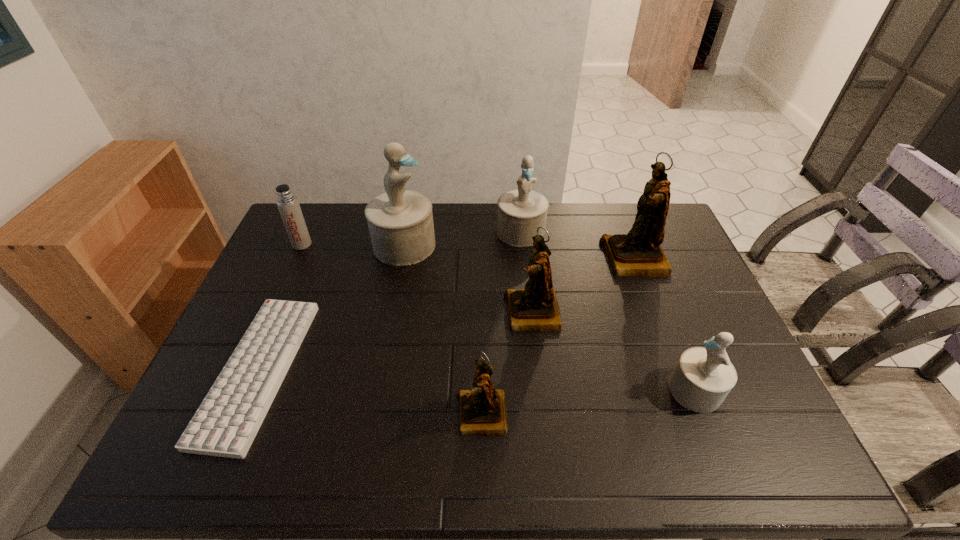
Where is `figurine that is at the near edge`? The image size is (960, 540). figurine that is at the near edge is located at coordinates (483, 412).

This screenshot has height=540, width=960. In order to click on computer keyboard that is at the near edge in this screenshot , I will do `click(225, 424)`.

Identify the location of thermos bottle present at the left edge. This screenshot has height=540, width=960. (287, 203).

Locate an element on the screen. computer keyboard that is at the left edge is located at coordinates (225, 424).

Locate an element on the screen. This screenshot has width=960, height=540. object that is at the far left corner is located at coordinates (287, 203).

You are a GUI agent. You are given a task and a screenshot of the screen. Output one action in this format:
    pyautogui.click(x=<x>, y=<y>)
    Task: Click on the object located at the near left corner
    
    Given the screenshot: What is the action you would take?
    [225, 424]

What are the coordinates of `object located at the far right corner` in the screenshot? It's located at (638, 253).

You are a GUI agent. You are given a task and a screenshot of the screen. Output one action in this format:
    pyautogui.click(x=<x>, y=<y>)
    Task: Click on the free space at the far edge of the desktop
    The height and width of the screenshot is (540, 960).
    Given the screenshot: What is the action you would take?
    pyautogui.click(x=351, y=237)

In the image, there is a desktop. Identify the location of vacant space at the near edge. This screenshot has width=960, height=540. (453, 448).

Image resolution: width=960 pixels, height=540 pixels. In order to click on free spot at the left edge of the desktop in this screenshot , I will do `click(262, 289)`.